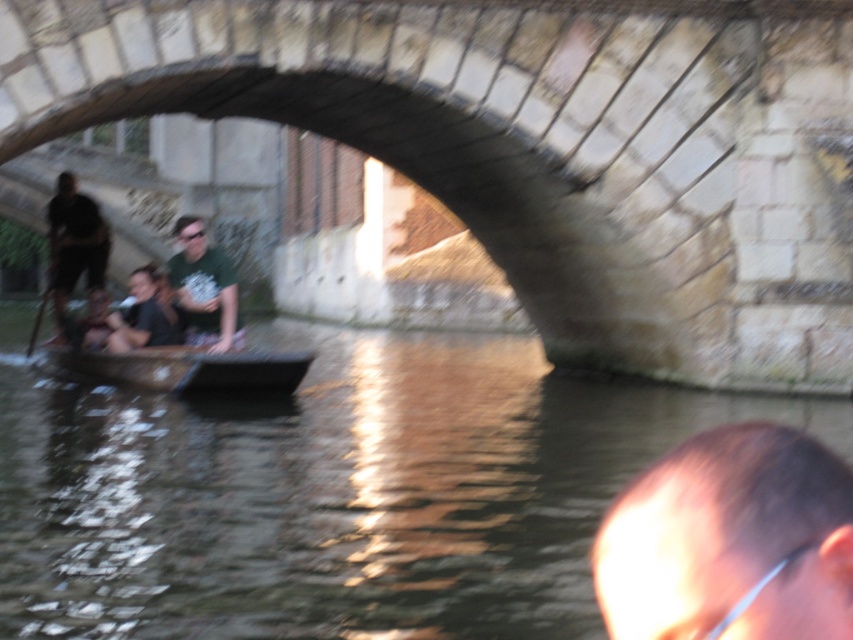
Question: Can you confirm if stone bridge at center is wider than dark green shirt at left?

Choices:
 (A) no
 (B) yes

Answer: (B)

Question: Which of the following is the farthest from the observer?

Choices:
 (A) dark green shirt at center
 (B) shiny black hair at lower right
 (C) stone bridge at center

Answer: (A)

Question: Is green matte shirt at center wider than dark green shirt at center?

Choices:
 (A) yes
 (B) no

Answer: (A)

Question: Among these objects, which one is nearest to the camera?

Choices:
 (A) dark green shirt at center
 (B) wooden canoe at center
 (C) shiny black hair at lower right

Answer: (C)

Question: Based on their relative distances, which object is farther from the brown wooden boat at lower left?

Choices:
 (A) shiny black hair at lower right
 (B) stone bridge at center
 (C) green matte shirt at center

Answer: (A)

Question: Does shiny black hair at lower right appear on the left side of green matte shirt at center?

Choices:
 (A) yes
 (B) no

Answer: (B)